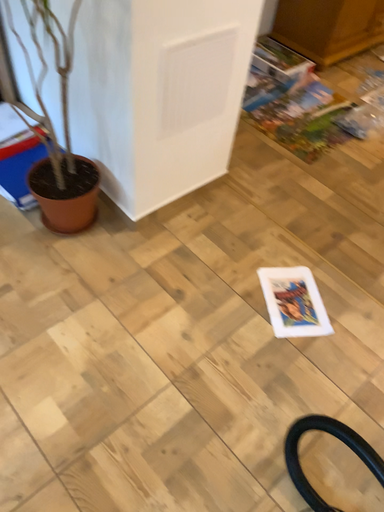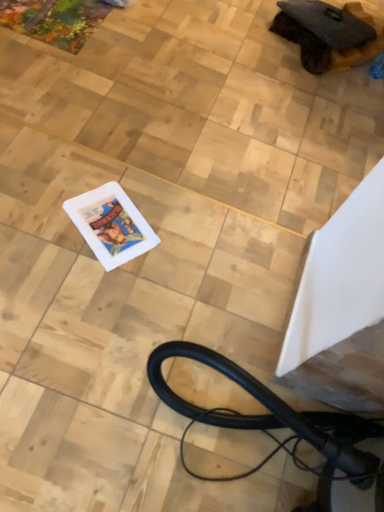
Question: Which way did the camera rotate in the video?

Choices:
 (A) rotated upward
 (B) rotated downward

Answer: (B)